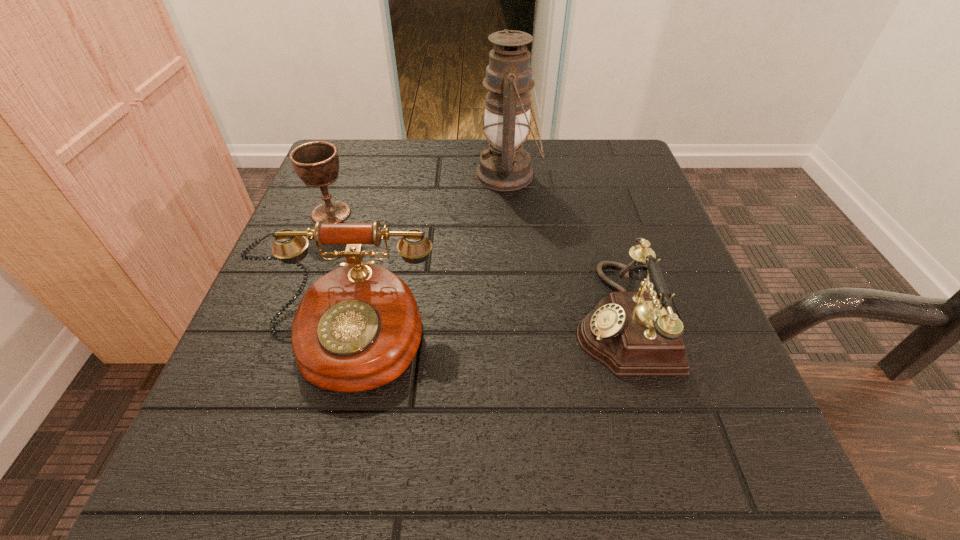
The image size is (960, 540). What are the coordinates of `free space located 0.210m on the dial of the shorter telephone` in the screenshot? It's located at (438, 317).

Identify the location of vacant space located on the dial of the shorter telephone. This screenshot has height=540, width=960. (380, 317).

The width and height of the screenshot is (960, 540). What are the coordinates of `vacant region located 0.360m on the dial of the shorter telephone` in the screenshot? It's located at (342, 317).

Locate an element on the screen. Image resolution: width=960 pixels, height=540 pixels. object present at the far edge is located at coordinates (504, 166).

This screenshot has height=540, width=960. I want to click on telephone situated at the left edge, so click(x=357, y=328).

Find the location of `chalice at the left edge`. chalice at the left edge is located at coordinates (316, 163).

Find the location of a particular element. The width and height of the screenshot is (960, 540). object that is at the right edge is located at coordinates (631, 333).

Locate an element on the screen. This screenshot has height=540, width=960. free space at the far edge of the desktop is located at coordinates (443, 174).

Where is `vacant space at the near edge`? This screenshot has width=960, height=540. vacant space at the near edge is located at coordinates (481, 472).

The width and height of the screenshot is (960, 540). What are the coordinates of `free location at the left edge` in the screenshot? It's located at (272, 282).